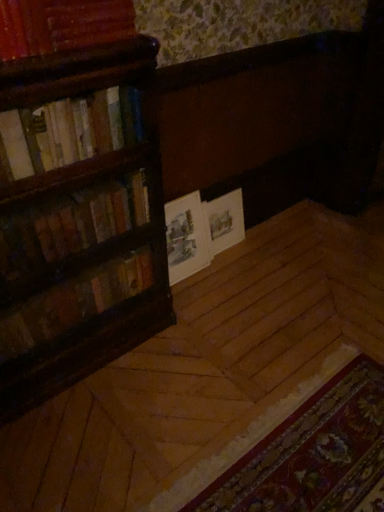
The width and height of the screenshot is (384, 512). What are the coordinates of `vacant area that lies in front of white paper at center` in the screenshot? It's located at (199, 294).